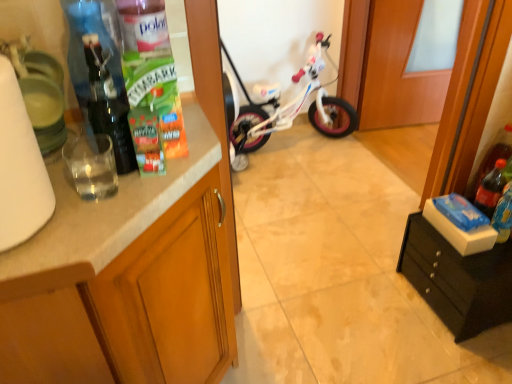
The height and width of the screenshot is (384, 512). I want to click on vacant region in front of clear plastic bottle at upper left, which is counted as the third bottle, starting from the back, so click(x=139, y=183).